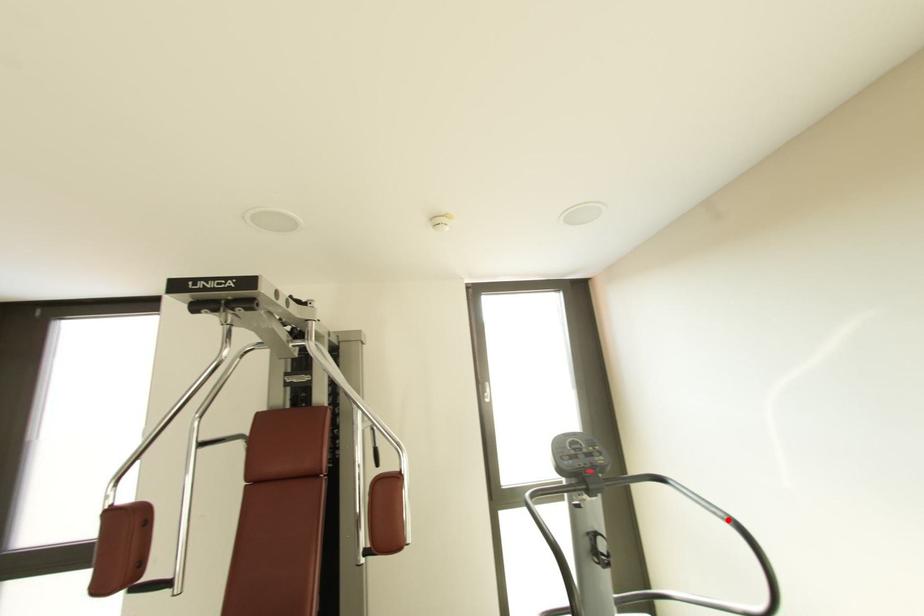
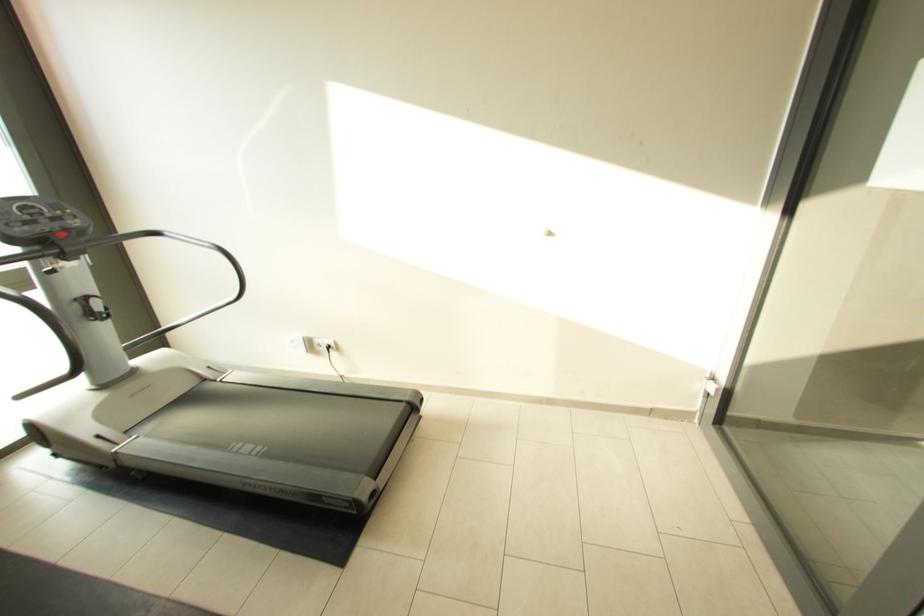
Where in the second image is the point corresponding to the highlighted location from the first image?

(214, 249)